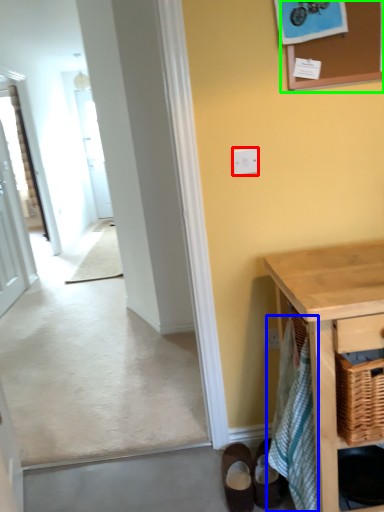
Question: Which object is the farthest from light switch (highlighted by a red box)? Choose among these: bath towel (highlighted by a blue box) or bulletin board (highlighted by a green box).

Choices:
 (A) bath towel
 (B) bulletin board

Answer: (A)